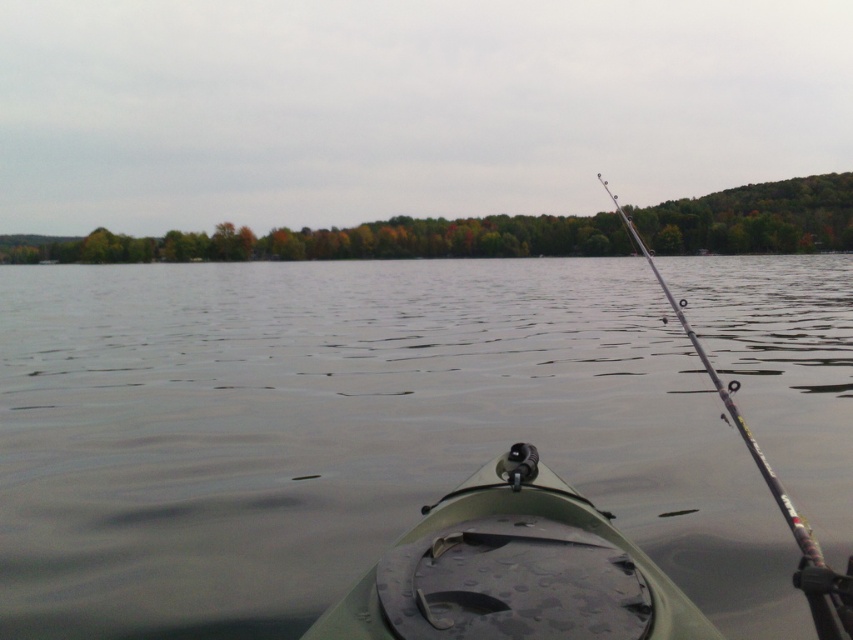
Can you confirm if transparent water at center is thinner than green matte kayak at center?

No, transparent water at center is not thinner than green matte kayak at center.

From the picture: Can you confirm if transparent water at center is bigger than green matte kayak at center?

Correct, transparent water at center is larger in size than green matte kayak at center.

Which is behind, point (61, 333) or point (582, 508)?

The point (61, 333) is more distant.

At what (x,y) coordinates should I click in order to perform the action: click on transparent water at center. Please return your answer as a coordinate pair (x, y). This screenshot has width=853, height=640. Looking at the image, I should click on pyautogui.click(x=344, y=435).

Can you confirm if transparent water at center is smaller than silver metallic rod at right?

Incorrect, transparent water at center is not smaller in size than silver metallic rod at right.

Find the location of `transparent water at center`. transparent water at center is located at coordinates (344, 435).

Who is more forward, (260, 509) or (805, 577)?

Point (805, 577) is more forward.

The height and width of the screenshot is (640, 853). Identify the location of transparent water at center. (344, 435).

Who is more distant from viewer, (422, 564) or (717, 390)?

The point (717, 390) is behind.

Is green matte kayak at center behind silver metallic rod at right?

Yes.

This screenshot has width=853, height=640. What are the coordinates of `green matte kayak at center` in the screenshot? It's located at (514, 570).

Where is `green matte kayak at center`? This screenshot has width=853, height=640. green matte kayak at center is located at coordinates (514, 570).